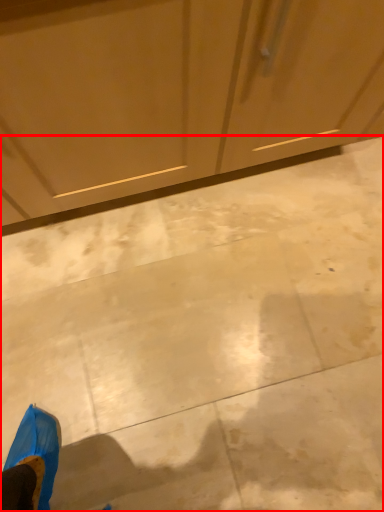
Question: From the image's perspective, where is concrete (annotated by the red box) located in relation to dresser in the image?

Choices:
 (A) below
 (B) above

Answer: (A)